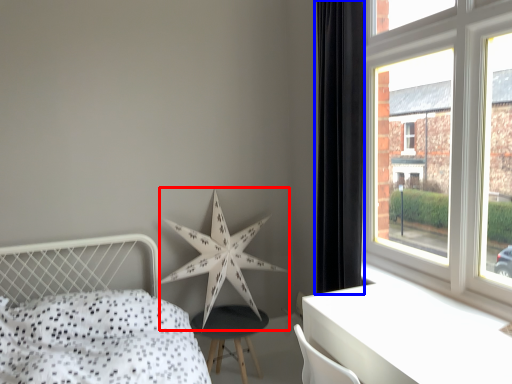
Question: Which object appears farthest to the camera in this image, star (highlighted by a red box) or curtain (highlighted by a blue box)?

Choices:
 (A) star
 (B) curtain

Answer: (A)